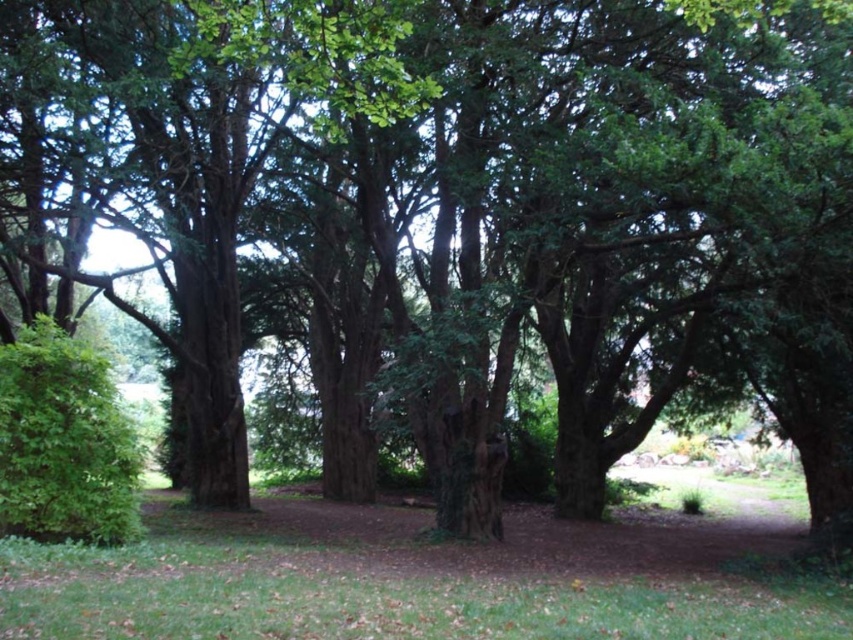
You are standing in the middle of the green grass at center and want to walk towards the green leafy hedge at lower left. Which direction should you move to reach the hedge without crossing the grass?

Since the green grass at center is wider than the green leafy hedge at lower left, you should move towards the lower left direction to reach the hedge without crossing the grass.

You are standing in the middle of the forest and see the green grass at center and the green leafy hedge at lower left. Which object is nearer to you?

The green grass at center is closer to the viewer than the green leafy hedge at lower left.